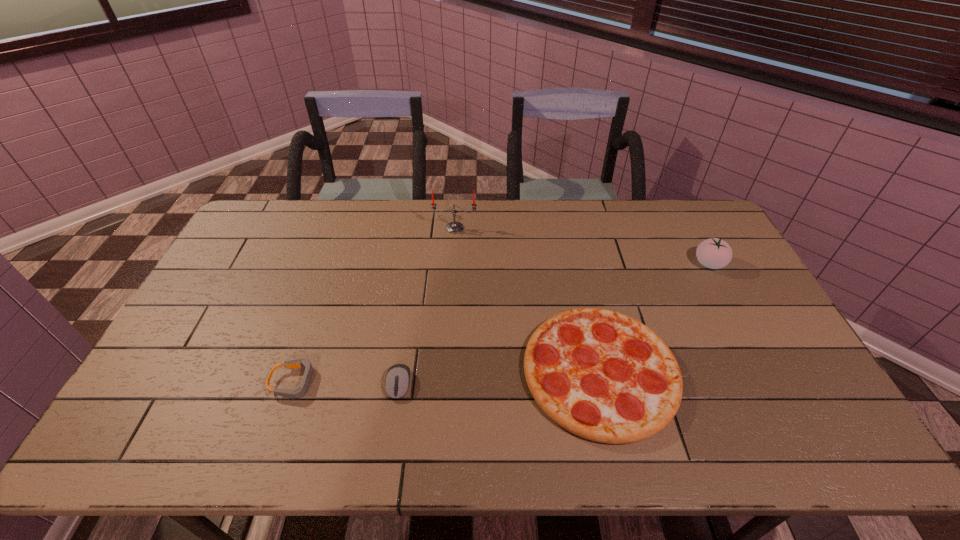
At what (x,y) coordinates should I click in order to perform the action: click on object that is the third closest to the fourth object from left to right. Please return your answer as a coordinate pair (x, y). This screenshot has width=960, height=540. Looking at the image, I should click on (454, 227).

I want to click on the fourth closest object to the computer equipment, so click(x=714, y=253).

Where is `free point that satisfies the following two spatial constraints: 1. on the front-facing side of the tallest object; 2. on the front and back of the leftmost object`? This screenshot has width=960, height=540. free point that satisfies the following two spatial constraints: 1. on the front-facing side of the tallest object; 2. on the front and back of the leftmost object is located at coordinates (445, 382).